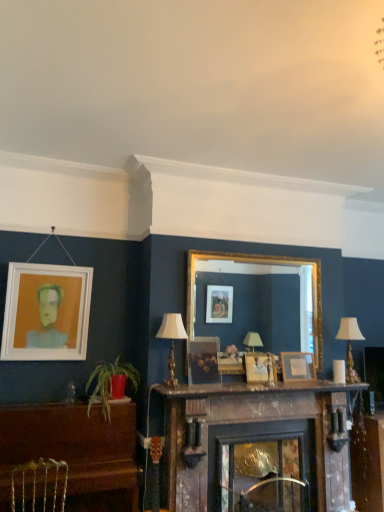
Question: From the image's perspective, is green leafy plant at lower left beneath metallic silver swivel chair at lower left?

Choices:
 (A) yes
 (B) no

Answer: (B)

Question: Is green leafy plant at lower left to the right of metallic silver swivel chair at lower left from the viewer's perspective?

Choices:
 (A) no
 (B) yes

Answer: (B)

Question: Is green leafy plant at lower left with metallic silver swivel chair at lower left?

Choices:
 (A) no
 (B) yes

Answer: (A)

Question: Is green leafy plant at lower left positioned far away from metallic silver swivel chair at lower left?

Choices:
 (A) no
 (B) yes

Answer: (A)

Question: Is the position of green leafy plant at lower left less distant than that of metallic silver swivel chair at lower left?

Choices:
 (A) no
 (B) yes

Answer: (A)

Question: In the image, is metallic silver swivel chair at lower left positioned in front of or behind white fabric lampshade at right, the 2th lamp when ordered from front to back?

Choices:
 (A) front
 (B) behind

Answer: (A)

Question: Is point (62, 507) positioned closer to the camera than point (354, 328)?

Choices:
 (A) farther
 (B) closer

Answer: (B)

Question: Is metallic silver swivel chair at lower left taller or shorter than white fabric lampshade at right, the 2th lamp when ordered from front to back?

Choices:
 (A) tall
 (B) short

Answer: (B)

Question: Would you say metallic silver swivel chair at lower left is to the left or to the right of white fabric lampshade at right, the 1th lamp when ordered from back to front, in the picture?

Choices:
 (A) right
 (B) left

Answer: (B)

Question: Looking at their shapes, would you say gold-framed mirror at center is wider or thinner than wooden mantle at center?

Choices:
 (A) thin
 (B) wide

Answer: (A)

Question: Looking at the image, does gold-framed mirror at center seem bigger or smaller compared to wooden mantle at center?

Choices:
 (A) big
 (B) small

Answer: (A)

Question: Considering the relative positions of gold-framed mirror at center and wooden mantle at center in the image provided, is gold-framed mirror at center to the left or to the right of wooden mantle at center?

Choices:
 (A) left
 (B) right

Answer: (A)

Question: Is gold-framed mirror at center situated inside wooden mantle at center or outside?

Choices:
 (A) inside
 (B) outside

Answer: (B)

Question: In terms of width, does green leafy plant at lower left look wider or thinner when compared to wooden picture frame at center, the 4th picture frame in the left-to-right sequence?

Choices:
 (A) wide
 (B) thin

Answer: (A)

Question: Would you say green leafy plant at lower left is to the left or to the right of wooden picture frame at center, positioned as the 1th picture frame in right-to-left order, in the picture?

Choices:
 (A) right
 (B) left

Answer: (B)